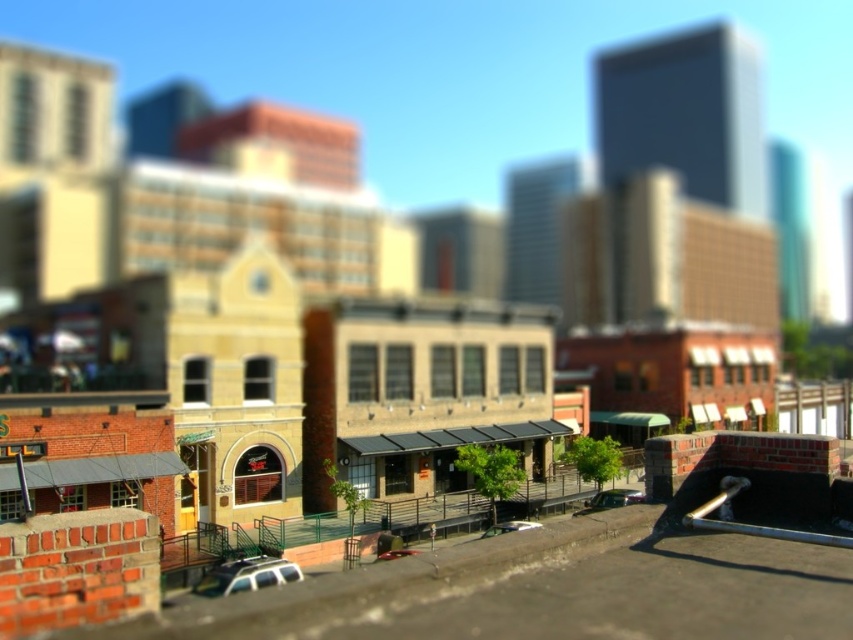
Question: Estimate the real-world distances between objects in this image. Which object is farther from the white matte car at lower center?

Choices:
 (A) metallic silver car at center
 (B) satin black car at lower center

Answer: (B)

Question: Does satin black car at lower center appear over metallic silver car at center?

Choices:
 (A) yes
 (B) no

Answer: (B)

Question: Which object is positioned farthest from the metallic silver car at center?

Choices:
 (A) satin black car at lower center
 (B) white matte car at lower center

Answer: (B)

Question: Does satin black car at lower center have a smaller size compared to metallic silver car at center?

Choices:
 (A) yes
 (B) no

Answer: (B)

Question: Among these points, which one is farthest from the camera?

Choices:
 (A) (599, 502)
 (B) (489, 529)

Answer: (A)

Question: Can you confirm if white matte car at lower center is smaller than metallic silver car at center?

Choices:
 (A) no
 (B) yes

Answer: (B)